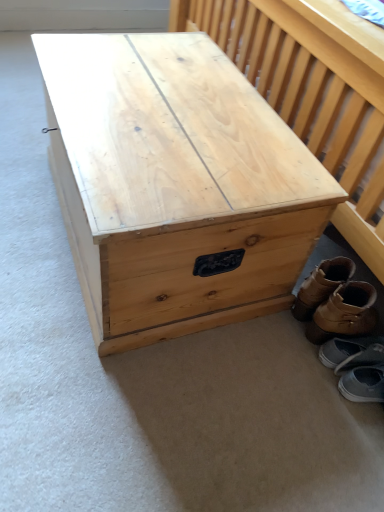
Question: Can you confirm if brown leather boots at lower right, which ranks as the 4th footwear in bottom-to-top order, is wider than natural wood trunk at center?

Choices:
 (A) no
 (B) yes

Answer: (A)

Question: Is natural wood trunk at center inside brown leather boots at lower right, which ranks as the 4th footwear in bottom-to-top order?

Choices:
 (A) no
 (B) yes

Answer: (A)

Question: Is brown leather boots at lower right, the 1th footwear viewed from the top, outside of natural wood trunk at center?

Choices:
 (A) yes
 (B) no

Answer: (A)

Question: Is brown leather boots at lower right, which ranks as the 4th footwear in bottom-to-top order, positioned before natural wood trunk at center?

Choices:
 (A) no
 (B) yes

Answer: (A)

Question: Does brown leather boots at lower right, which ranks as the 4th footwear in bottom-to-top order, appear on the left side of natural wood trunk at center?

Choices:
 (A) yes
 (B) no

Answer: (B)

Question: Considering the positions of point (382, 352) and point (359, 286), is point (382, 352) closer or farther from the camera than point (359, 286)?

Choices:
 (A) closer
 (B) farther

Answer: (A)

Question: Would you say gray fabric shoe at lower right, the 2th footwear ordered from the bottom, is to the left or to the right of brown leather boot at lower right, which is counted as the second footwear, starting from the top, in the picture?

Choices:
 (A) right
 (B) left

Answer: (A)

Question: Choose the correct answer: Is gray fabric shoe at lower right, positioned as the 3th footwear in top-to-bottom order, inside brown leather boot at lower right, which is counted as the second footwear, starting from the top, or outside it?

Choices:
 (A) inside
 (B) outside

Answer: (B)

Question: Considering their positions, is gray fabric shoe at lower right, positioned as the 3th footwear in top-to-bottom order, located in front of or behind brown leather boot at lower right, which is counted as the 3th footwear, starting from the bottom?

Choices:
 (A) behind
 (B) front

Answer: (A)

Question: Considering the positions of brown leather boots at lower right, which ranks as the 4th footwear in bottom-to-top order, and gray suede shoes at lower right, placed as the 1th footwear when sorted from bottom to top, in the image, is brown leather boots at lower right, which ranks as the 4th footwear in bottom-to-top order, wider or thinner than gray suede shoes at lower right, placed as the 1th footwear when sorted from bottom to top,?

Choices:
 (A) thin
 (B) wide

Answer: (A)

Question: Relative to gray suede shoes at lower right, arranged as the fourth footwear when viewed from the top, is brown leather boots at lower right, which ranks as the 4th footwear in bottom-to-top order, in front or behind?

Choices:
 (A) front
 (B) behind

Answer: (B)

Question: Is brown leather boots at lower right, which ranks as the 4th footwear in bottom-to-top order, to the left or to the right of gray suede shoes at lower right, arranged as the fourth footwear when viewed from the top, in the image?

Choices:
 (A) right
 (B) left

Answer: (B)

Question: From their relative heights in the image, would you say brown leather boots at lower right, the 1th footwear viewed from the top, is taller or shorter than gray suede shoes at lower right, arranged as the fourth footwear when viewed from the top?

Choices:
 (A) tall
 (B) short

Answer: (A)

Question: From a real-world perspective, relative to natural wood trunk at center, is brown leather boot at lower right, which is counted as the 3th footwear, starting from the bottom, vertically above or below?

Choices:
 (A) below
 (B) above

Answer: (A)

Question: Considering their positions, is brown leather boot at lower right, which is counted as the 3th footwear, starting from the bottom, located in front of or behind natural wood trunk at center?

Choices:
 (A) front
 (B) behind

Answer: (B)